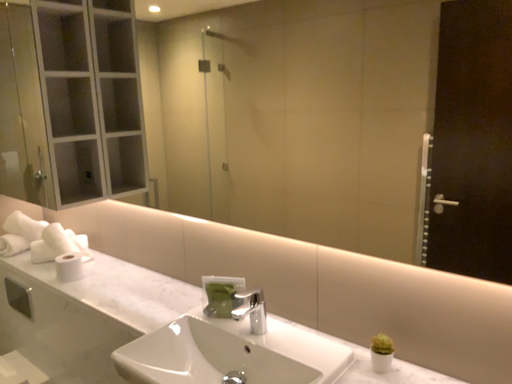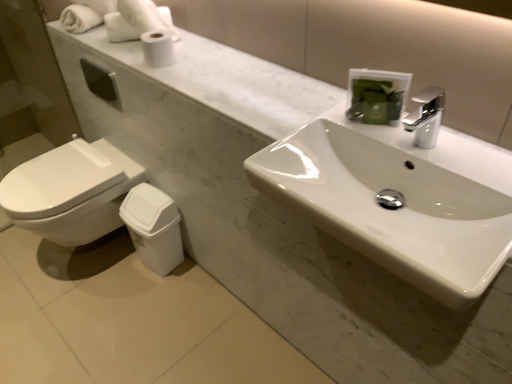
Question: Which way did the camera rotate in the video?

Choices:
 (A) rotated upward
 (B) rotated downward

Answer: (B)